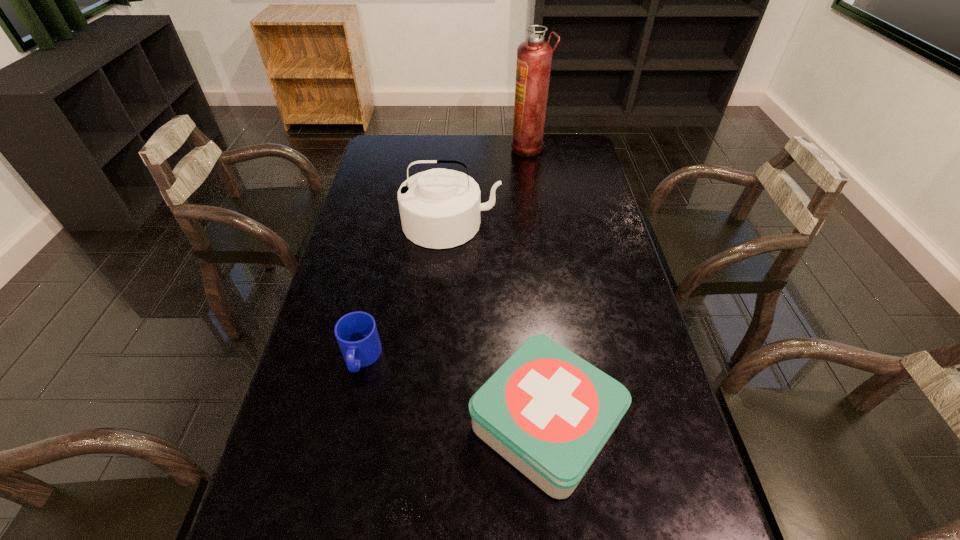
This screenshot has height=540, width=960. I want to click on object that stands as the second closest to the third shortest object, so click(x=356, y=332).

Find the location of a particular element. Image resolution: width=960 pixels, height=540 pixels. vacant point that satisfies the following two spatial constraints: 1. on the spout of the kettle; 2. on the left side of the first-aid kit is located at coordinates (437, 423).

Identify the location of free space that satisfies the following two spatial constraints: 1. on the spout of the second farthest object; 2. on the left side of the first-aid kit. The image size is (960, 540). (437, 423).

The width and height of the screenshot is (960, 540). Find the location of `free region that satisfies the following two spatial constraints: 1. on the side with the handle of the first-aid kit; 2. on the right side of the mug`. free region that satisfies the following two spatial constraints: 1. on the side with the handle of the first-aid kit; 2. on the right side of the mug is located at coordinates (347, 423).

Find the location of a particular element. The image size is (960, 540). vacant space that satisfies the following two spatial constraints: 1. on the side of the tallest object with the label; 2. on the side with the handle of the mug is located at coordinates (560, 358).

At what (x,y) coordinates should I click in order to perform the action: click on free spot that satisfies the following two spatial constraints: 1. on the side of the farthest object with the label; 2. on the spout of the kettle. Please return your answer as a coordinate pair (x, y). The image size is (960, 540). Looking at the image, I should click on (540, 224).